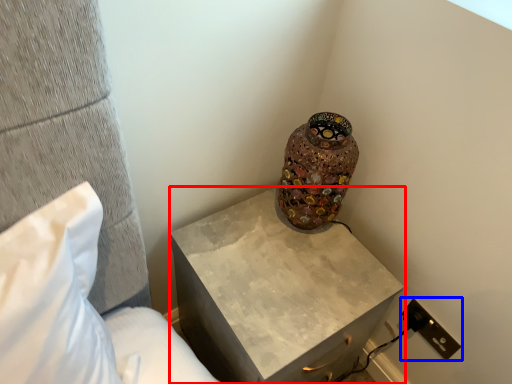
Question: Among these objects, which one is nearest to the camera, nightstand (highlighted by a red box) or electric outlet (highlighted by a blue box)?

Choices:
 (A) nightstand
 (B) electric outlet

Answer: (A)